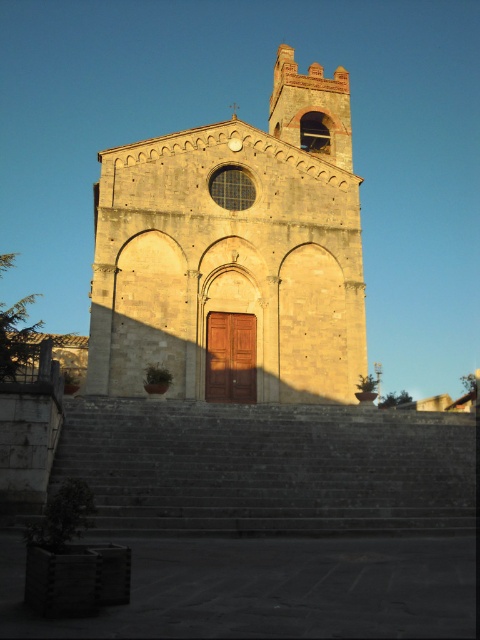
Question: Is the position of golden stone church at center more distant than that of gray stone stairs at lower center?

Choices:
 (A) yes
 (B) no

Answer: (A)

Question: From the image, what is the correct spatial relationship of golden stone church at center in relation to gray stone stairs at lower center?

Choices:
 (A) right
 (B) left

Answer: (A)

Question: Which point is farther to the camera?

Choices:
 (A) gray stone stairs at lower center
 (B) golden stone church at center

Answer: (B)

Question: Does golden stone church at center have a larger size compared to gray stone stairs at lower center?

Choices:
 (A) no
 (B) yes

Answer: (B)

Question: Which of the following is the farthest from the observer?

Choices:
 (A) gray stone stairs at lower center
 (B) golden stone church at center

Answer: (B)